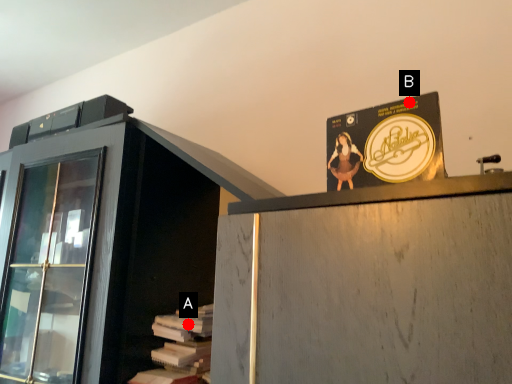
Question: Two points are circled on the image, labeled by A and B beside each circle. Which point is farther from the camera taking this photo?

Choices:
 (A) A is further
 (B) B is further

Answer: (A)